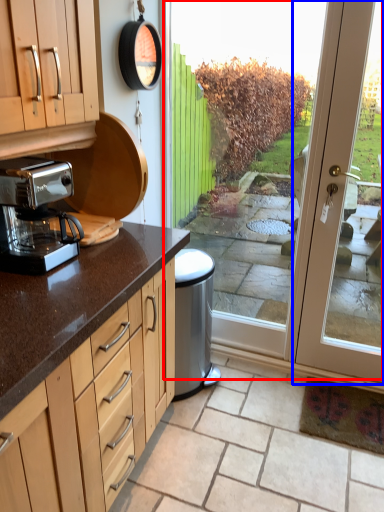
Question: Among these objects, which one is farthest to the camera, screen door (highlighted by a red box) or door (highlighted by a blue box)?

Choices:
 (A) screen door
 (B) door

Answer: (A)